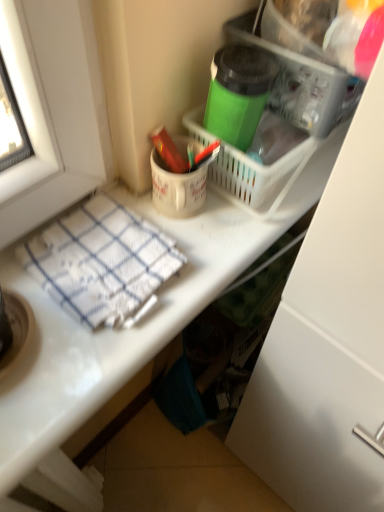
Question: Relative to white woven towel at lower left, is green matte thermos at upper center in front or behind?

Choices:
 (A) front
 (B) behind

Answer: (B)

Question: Based on their positions, is green matte thermos at upper center located to the left or right of white woven towel at lower left?

Choices:
 (A) left
 (B) right

Answer: (B)

Question: Estimate the real-world distances between objects in this image. Which object is farther from the matte red crayon at upper center?

Choices:
 (A) white woven towel at lower left
 (B) green matte thermos at upper center

Answer: (A)

Question: Which object is positioned farthest from the matte red crayon at upper center?

Choices:
 (A) white woven towel at lower left
 (B) green matte thermos at upper center

Answer: (A)